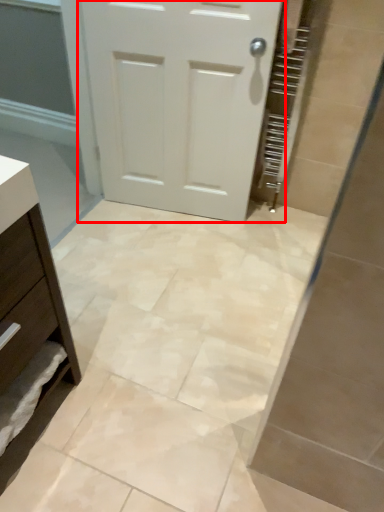
Question: In this image, where is door (annotated by the red box) located relative to chest of drawers?

Choices:
 (A) left
 (B) right

Answer: (B)